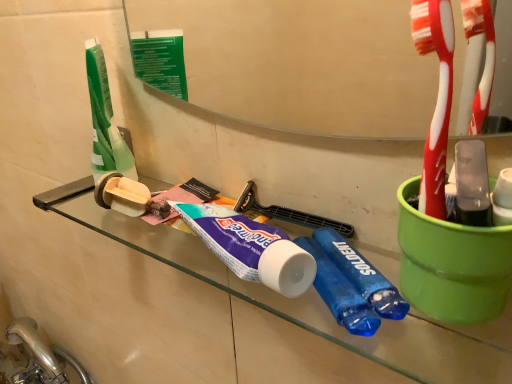
This screenshot has width=512, height=384. Describe the element at coordinates (251, 248) in the screenshot. I see `purple matte toothpaste at center` at that location.

Where is `transparent glass shelf at center`? transparent glass shelf at center is located at coordinates (315, 304).

This screenshot has height=384, width=512. What do you see at coordinates (36, 347) in the screenshot?
I see `satin nickel faucet at lower left` at bounding box center [36, 347].

Measure the distance between beige cardboard toilet paper at left and camera.

The depth of beige cardboard toilet paper at left is 16.18 inches.

Where is `purple matte toothpaste at center`? Image resolution: width=512 pixels, height=384 pixels. purple matte toothpaste at center is located at coordinates (251, 248).

At what (x,y) coordinates should I click in order to perform the action: click on faucet that is under the purple matte toothpaste at center (from a real-world perspective). Please return your answer as a coordinate pair (x, y). This screenshot has width=512, height=384. Looking at the image, I should click on (36, 347).

Considering the positions of objects purple matte toothpaste at center and satin nickel faucet at lower left in the image provided, who is more to the right, purple matte toothpaste at center or satin nickel faucet at lower left?

purple matte toothpaste at center is more to the right.

How many degrees apart are the facing directions of purple matte toothpaste at center and satin nickel faucet at lower left?

The facing directions of purple matte toothpaste at center and satin nickel faucet at lower left are 75.1 degrees apart.

How distant is purple matte toothpaste at center from satin nickel faucet at lower left?

They are 32.84 inches apart.

From the image's perspective, is satin nickel faucet at lower left located above or below beige cardboard toilet paper at left?

From the image's perspective, satin nickel faucet at lower left appears below beige cardboard toilet paper at left.

Does satin nickel faucet at lower left come in front of beige cardboard toilet paper at left?

No, satin nickel faucet at lower left is further to the viewer.

Considering the relative sizes of satin nickel faucet at lower left and beige cardboard toilet paper at left in the image provided, is satin nickel faucet at lower left smaller than beige cardboard toilet paper at left?

Actually, satin nickel faucet at lower left might be larger than beige cardboard toilet paper at left.

Looking at this image, does satin nickel faucet at lower left turn towards beige cardboard toilet paper at left?

No, satin nickel faucet at lower left does not turn towards beige cardboard toilet paper at left.

Is beige cardboard toilet paper at left not near satin nickel faucet at lower left?

That's not correct — beige cardboard toilet paper at left is a little close to satin nickel faucet at lower left.

Consider the image. Considering the sizes of objects beige cardboard toilet paper at left and satin nickel faucet at lower left in the image provided, who is taller, beige cardboard toilet paper at left or satin nickel faucet at lower left?

Standing taller between the two is satin nickel faucet at lower left.

Which of these two, beige cardboard toilet paper at left or satin nickel faucet at lower left, is wider?

satin nickel faucet at lower left is wider.

What's the angular difference between beige cardboard toilet paper at left and satin nickel faucet at lower left's facing directions?

0.497 degrees.

How different are the orientations of transparent glass shelf at center and satin nickel faucet at lower left in degrees?

The facing directions of transparent glass shelf at center and satin nickel faucet at lower left are 1.03 degrees apart.

Does transparent glass shelf at center appear on the left side of satin nickel faucet at lower left?

No, transparent glass shelf at center is not to the left of satin nickel faucet at lower left.

Is transparent glass shelf at center next to satin nickel faucet at lower left and touching it?

transparent glass shelf at center and satin nickel faucet at lower left are not in contact.

Is transparent glass shelf at center bigger than satin nickel faucet at lower left?

Actually, transparent glass shelf at center might be smaller than satin nickel faucet at lower left.

Is the position of transparent glass shelf at center more distant than that of purple matte toothpaste at center?

No, transparent glass shelf at center is closer to the viewer.

Does point (470, 374) lie behind point (298, 283)?

Yes, point (470, 374) is farther from viewer.

Could you tell me if transparent glass shelf at center is turned towards purple matte toothpaste at center?

Yes, transparent glass shelf at center is facing purple matte toothpaste at center.

Is transparent glass shelf at center placed right next to purple matte toothpaste at center?

No, transparent glass shelf at center is not next to purple matte toothpaste at center.

Which of these two, satin nickel faucet at lower left or purple matte toothpaste at center, is wider?

Wider between the two is satin nickel faucet at lower left.

From a real-world perspective, who is located higher, satin nickel faucet at lower left or purple matte toothpaste at center?

purple matte toothpaste at center is physically above.

Does satin nickel faucet at lower left come in front of purple matte toothpaste at center?

No, the depth of satin nickel faucet at lower left is greater than that of purple matte toothpaste at center.

From the image's perspective, relative to purple matte toothpaste at center, is satin nickel faucet at lower left above or below?

satin nickel faucet at lower left is below purple matte toothpaste at center.

In terms of width, does purple matte toothpaste at center look wider or thinner when compared to transparent glass shelf at center?

In the image, purple matte toothpaste at center appears to be wider than transparent glass shelf at center.

Could you tell me if purple matte toothpaste at center is facing transparent glass shelf at center?

Yes, purple matte toothpaste at center is aimed at transparent glass shelf at center.

From a real-world perspective, which object rests below the other?

In real-world perspective, transparent glass shelf at center is lower.

Considering the points (242, 228) and (90, 180), which point is in front, point (242, 228) or point (90, 180)?

Point (242, 228)

What are the coordinates of `toothpaste above the satin nickel faucet at lower left (from a real-world perspective)` in the screenshot? It's located at (251, 248).

At what (x,y) coordinates should I click in order to perform the action: click on faucet below the beige cardboard toilet paper at left (from the image's perspective). Please return your answer as a coordinate pair (x, y). This screenshot has height=384, width=512. Looking at the image, I should click on (36, 347).

Considering their positions, is purple matte toothpaste at center positioned further to satin nickel faucet at lower left than beige cardboard toilet paper at left?

Among the two, purple matte toothpaste at center is located further to satin nickel faucet at lower left.

Estimate the real-world distances between objects in this image. Which object is further from beige cardboard toilet paper at left, satin nickel faucet at lower left or purple matte toothpaste at center?

Among the two, satin nickel faucet at lower left is located further to beige cardboard toilet paper at left.

Estimate the real-world distances between objects in this image. Which object is further from beige cardboard toilet paper at left, purple matte toothpaste at center or satin nickel faucet at lower left?

satin nickel faucet at lower left is positioned further to the anchor beige cardboard toilet paper at left.

Which object lies nearer to the anchor point beige cardboard toilet paper at left, transparent glass shelf at center or purple matte toothpaste at center?

The object closer to beige cardboard toilet paper at left is purple matte toothpaste at center.

Looking at the image, which one is located further to transparent glass shelf at center, beige cardboard toilet paper at left or satin nickel faucet at lower left?

satin nickel faucet at lower left is positioned further to the anchor transparent glass shelf at center.

Estimate the real-world distances between objects in this image. Which object is closer to beige cardboard toilet paper at left, transparent glass shelf at center or satin nickel faucet at lower left?

transparent glass shelf at center lies closer to beige cardboard toilet paper at left than the other object.

When comparing their distances from purple matte toothpaste at center, does satin nickel faucet at lower left or beige cardboard toilet paper at left seem closer?

beige cardboard toilet paper at left is positioned closer to the anchor purple matte toothpaste at center.

Looking at this image, based on their spatial positions, is purple matte toothpaste at center or beige cardboard toilet paper at left closer to transparent glass shelf at center?

purple matte toothpaste at center is positioned closer to the anchor transparent glass shelf at center.

Where is `toothpaste between transparent glass shelf at center and beige cardboard toilet paper at left in the front-back direction`? The image size is (512, 384). toothpaste between transparent glass shelf at center and beige cardboard toilet paper at left in the front-back direction is located at coordinates (251, 248).

The width and height of the screenshot is (512, 384). I want to click on toilet paper positioned between purple matte toothpaste at center and satin nickel faucet at lower left from near to far, so click(x=122, y=195).

At what (x,y) coordinates should I click in order to perform the action: click on toothpaste between transparent glass shelf at center and satin nickel faucet at lower left along the z-axis. Please return your answer as a coordinate pair (x, y). Looking at the image, I should click on (251, 248).

You are a GUI agent. You are given a task and a screenshot of the screen. Output one action in this format:
    pyautogui.click(x=<x>, y=<y>)
    Task: Click on the toilet paper positioned between transparent glass shelf at center and satin nickel faucet at lower left from near to far
    
    Given the screenshot: What is the action you would take?
    pyautogui.click(x=122, y=195)